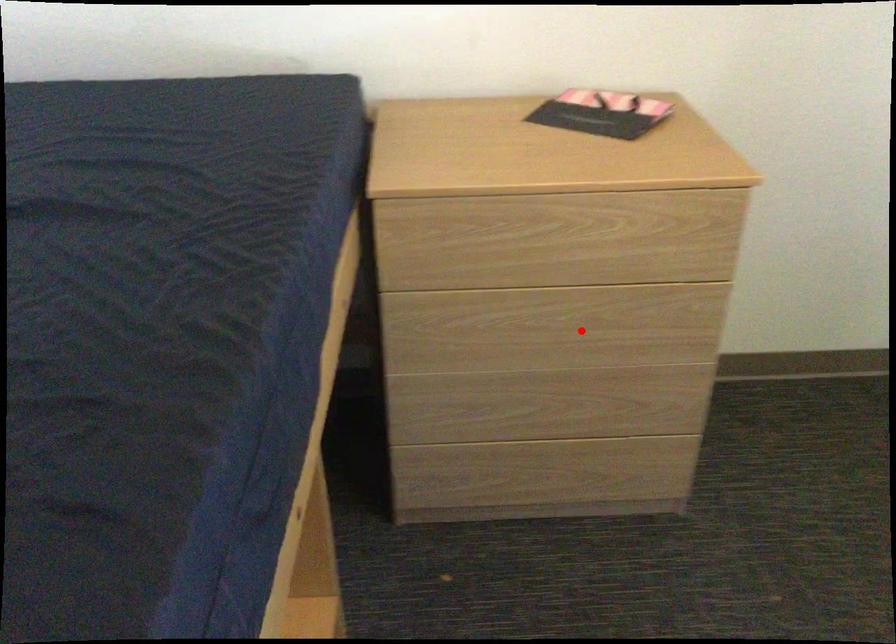
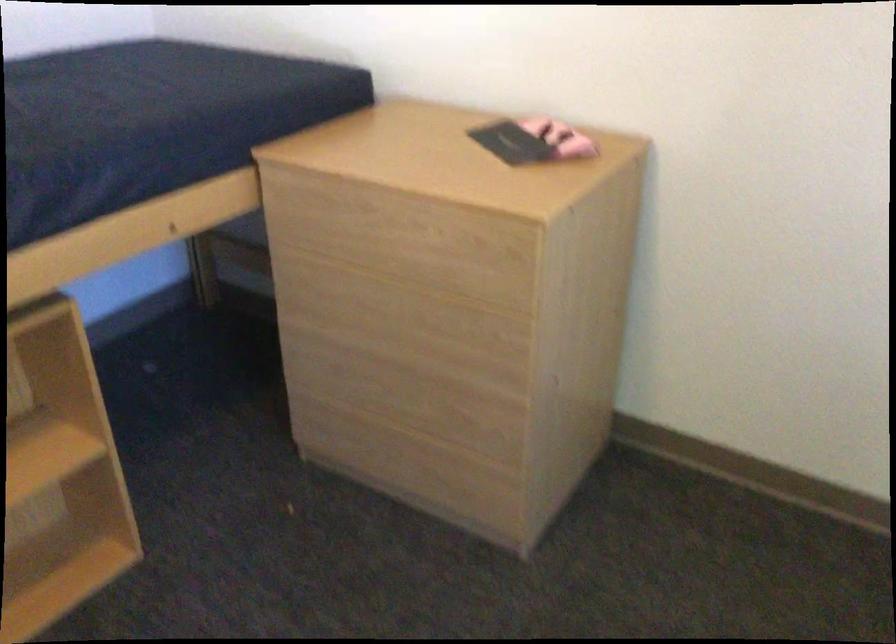
In the second image, find the point that corresponds to the highlighted location in the first image.

(410, 327)